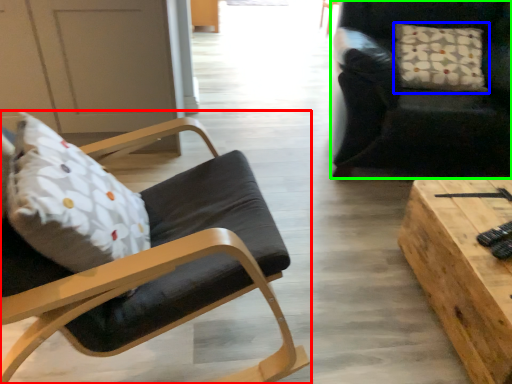
Question: Estimate the real-world distances between objects in this image. Which object is closer to chair (highlighted by a red box), pillow (highlighted by a blue box) or chair (highlighted by a green box)?

Choices:
 (A) pillow
 (B) chair

Answer: (B)